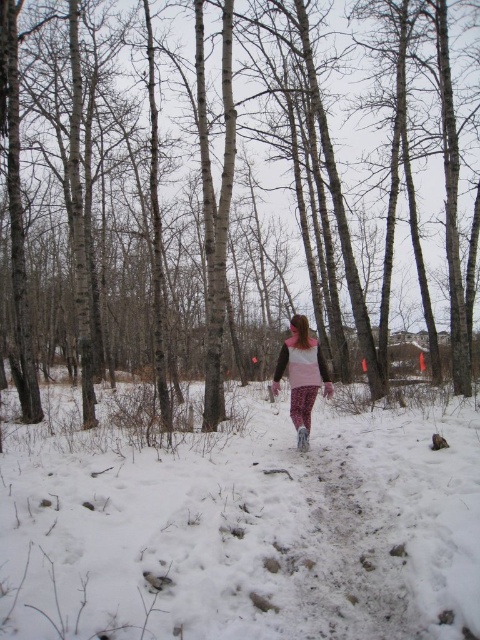
Is brown smooth tree at center positioned behind white powdery snow at center?

Yes, brown smooth tree at center is further from the viewer.

Does brown smooth tree at center have a greater width compared to white powdery snow at center?

Yes, brown smooth tree at center is wider than white powdery snow at center.

What do you see at coordinates (216, 189) in the screenshot? I see `brown smooth tree at center` at bounding box center [216, 189].

This screenshot has width=480, height=640. I want to click on brown smooth tree at center, so click(216, 189).

Is brown smooth tree at center further to camera compared to pink fleece jacket at center?

No, it is in front of pink fleece jacket at center.

Between brown smooth tree at center and pink fleece jacket at center, which one has less height?

pink fleece jacket at center is shorter.

Which is in front, point (67, 204) or point (297, 339)?

Point (297, 339) is in front.

Find the location of a particular element. brown smooth tree at center is located at coordinates (216, 189).

Is white powdery snow at center bigger than pink fleece jacket at center?

Yes.

Who is shorter, white powdery snow at center or pink fleece jacket at center?

white powdery snow at center

Locate an element on the screen. This screenshot has height=640, width=480. white powdery snow at center is located at coordinates (244, 529).

You are a GUI agent. You are given a task and a screenshot of the screen. Output one action in this format:
    pyautogui.click(x=<x>, y=<y>)
    Task: Click on the white powdery snow at center
    The width and height of the screenshot is (480, 640).
    Given the screenshot: What is the action you would take?
    pyautogui.click(x=244, y=529)